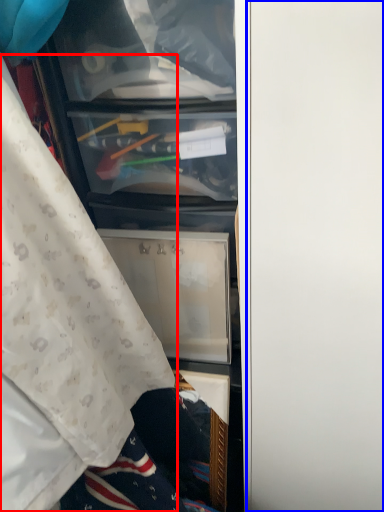
Question: Which object is further to the camera taking this photo, curtain (highlighted by a red box) or door (highlighted by a blue box)?

Choices:
 (A) curtain
 (B) door

Answer: (B)